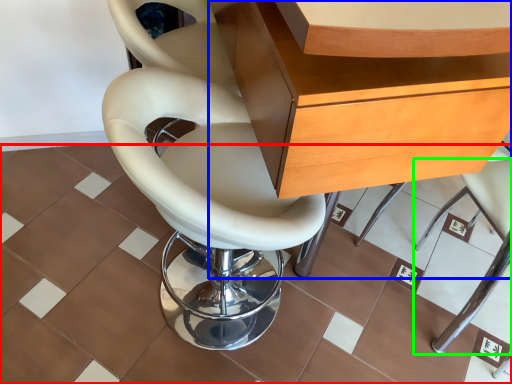
Question: Estimate the real-world distances between objects in this image. Which object is closer to ceramic tile (highlighted by a red box), desk (highlighted by a blue box) or chair (highlighted by a green box)?

Choices:
 (A) desk
 (B) chair

Answer: (B)